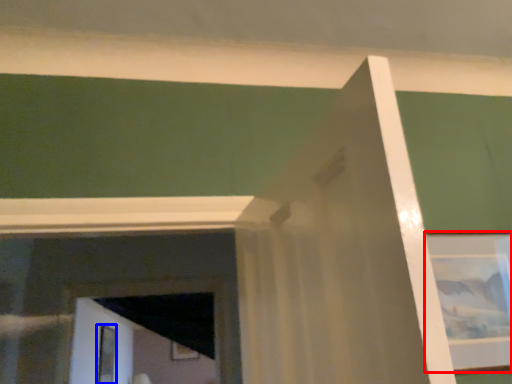
Question: Which point is closer to the camera, picture frame (highlighted by a red box) or screen door (highlighted by a blue box)?

Choices:
 (A) picture frame
 (B) screen door

Answer: (A)